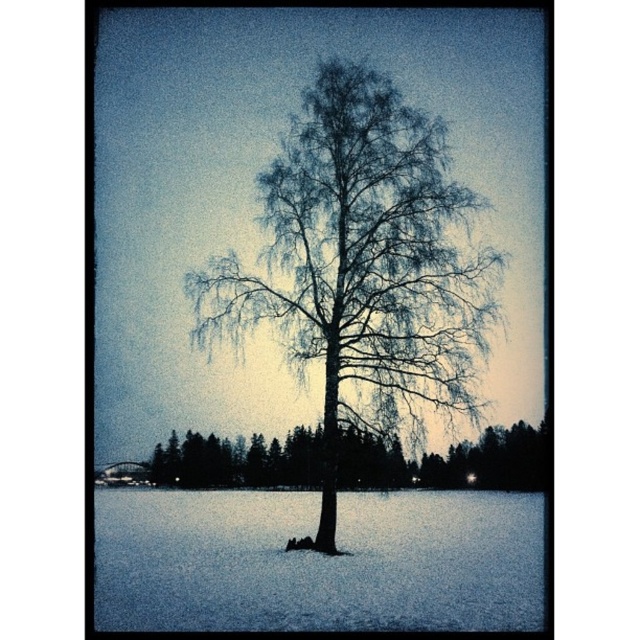
Is point (346, 211) positioned after point (289, 483)?

No, it is in front of (289, 483).

Which is more to the right, bare branches at center or snowy bark tree at center?

snowy bark tree at center is more to the right.

Locate an element on the screen. bare branches at center is located at coordinates (362, 266).